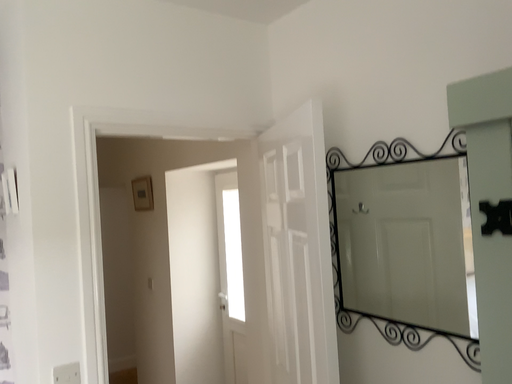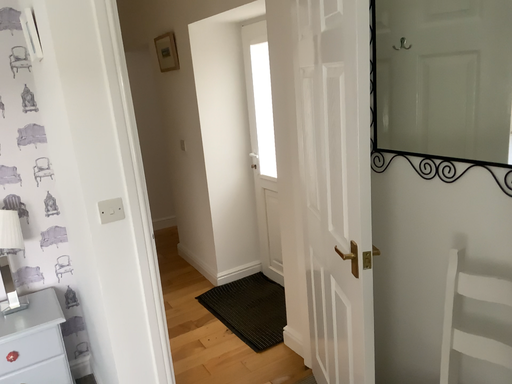
Question: How did the camera likely rotate when shooting the video?

Choices:
 (A) rotated upward
 (B) rotated downward

Answer: (B)